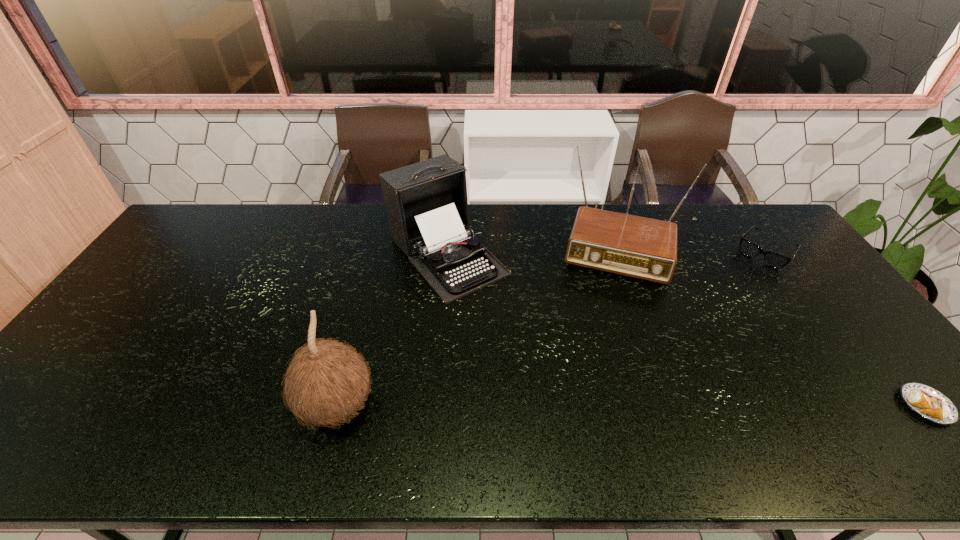
Locate an element on the screen. This screenshot has height=540, width=960. free space between the coconut and the third object from right to left is located at coordinates (476, 323).

You are a GUI agent. You are given a task and a screenshot of the screen. Output one action in this format:
    pyautogui.click(x=<x>, y=<y>)
    Task: Click on the unoccupied position between the fourth tallest object and the coconut
    This screenshot has width=960, height=540.
    Given the screenshot: What is the action you would take?
    pyautogui.click(x=551, y=329)

The width and height of the screenshot is (960, 540). Find the location of `object identified as the closest to the pastry`. object identified as the closest to the pastry is located at coordinates (772, 259).

Point out which object is positioned as the fourth nearest to the pastry. Please provide its 2D coordinates. Your answer should be formatted as a tuple, i.e. [(x, y)], where the tuple contains the x and y coordinates of a point satisfying the conditions above.

[(327, 381)]

The height and width of the screenshot is (540, 960). Identify the location of free point that satisfies the following two spatial constraints: 1. on the front side of the sunglasses; 2. on the left side of the third object from right to left. (619, 252).